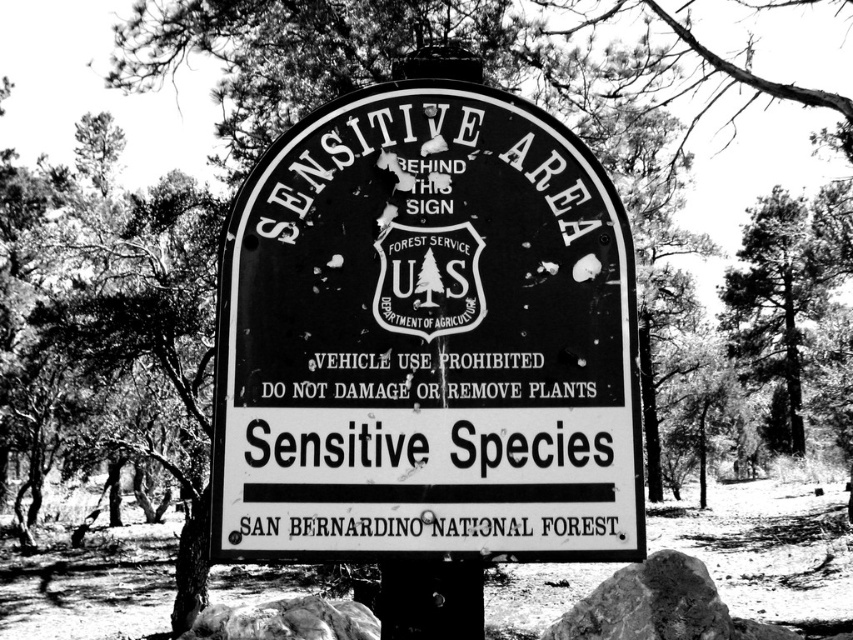
Is smooth rock at lower right above black paper text at lower center?

Incorrect, smooth rock at lower right is not positioned above black paper text at lower center.

The image size is (853, 640). I want to click on smooth rock at lower right, so click(x=648, y=604).

Where is `smooth rock at lower right`? Image resolution: width=853 pixels, height=640 pixels. smooth rock at lower right is located at coordinates (648, 604).

Who is shorter, dark green textured tree at right or smooth rock at lower right?

With less height is dark green textured tree at right.

Between point (740, 280) and point (631, 595), which one is positioned behind?

The point (740, 280) is more distant.

Which is in front, point (779, 289) or point (671, 554)?

Positioned in front is point (671, 554).

Locate an element on the screen. Image resolution: width=853 pixels, height=640 pixels. dark green textured tree at right is located at coordinates (785, 285).

Is point (582, 326) positioned before point (830, 195)?

Yes.

Does black metal sign at center have a smaller size compared to dark green textured tree at right?

No, black metal sign at center is not smaller than dark green textured tree at right.

Who is more distant from viewer, (602, 403) or (833, 413)?

The point (833, 413) is more distant.

This screenshot has width=853, height=640. I want to click on black metal sign at center, so click(x=427, y=339).